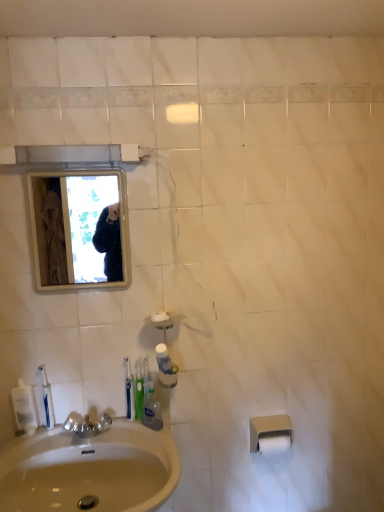
This screenshot has width=384, height=512. In order to click on free space in front of white plastic toothbrush at lower left, the first toothbrush in the left-to-right sequence in this screenshot , I will do `click(130, 439)`.